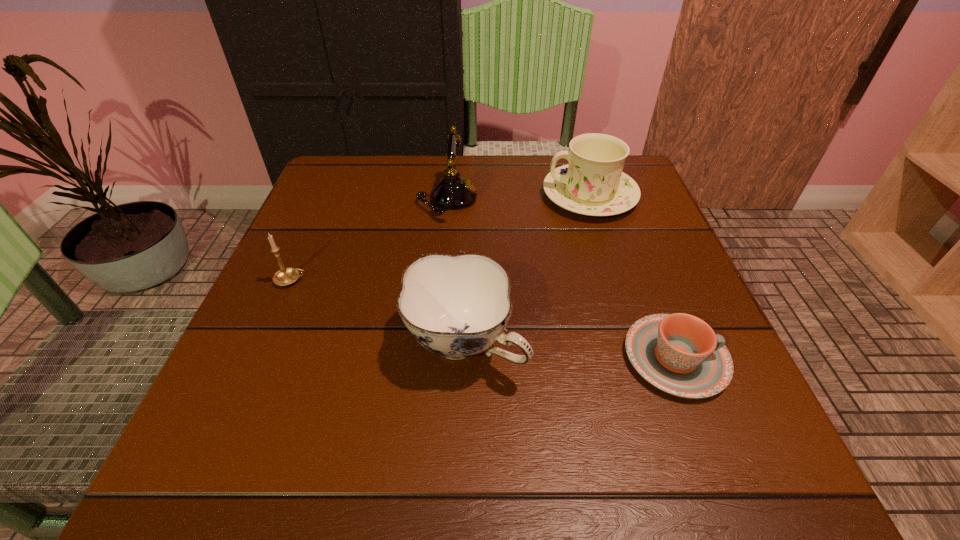
This screenshot has height=540, width=960. Find the location of `vacant space at the near left corner of the desktop`. vacant space at the near left corner of the desktop is located at coordinates (208, 471).

You are a GUI agent. You are given a task and a screenshot of the screen. Output one action in this format:
    pyautogui.click(x=<x>, y=<y>)
    Task: Click on the blank area at the far right corner
    
    Given the screenshot: What is the action you would take?
    pyautogui.click(x=625, y=163)

Find the location of a particular element. This screenshot has height=540, width=960. unoccupied area between the telephone and the shortest chinaware is located at coordinates tap(562, 278).

You are a GUI agent. You are given a task and a screenshot of the screen. Output one action in this format:
    pyautogui.click(x=<x>, y=<y>)
    Task: Click on the vacant area between the farthest chinaware and the shortest object
    
    Given the screenshot: What is the action you would take?
    pyautogui.click(x=633, y=277)

I want to click on free space that is in between the leftmost object and the telephone, so click(x=370, y=239).

Locate an element on the screen. free space between the farthest chinaware and the candle holder is located at coordinates (441, 238).

Identify the location of empty space between the telephone and the shortest chinaware. (562, 278).

The width and height of the screenshot is (960, 540). What are the coordinates of `vacant space that is in between the telephone and the farthest chinaware` in the screenshot? It's located at (x=518, y=197).

In order to click on empty space between the leftmost chinaware and the farthest chinaware in this screenshot , I will do `click(528, 269)`.

Identify the location of vacant area that lies between the telephone and the shortest chinaware. This screenshot has width=960, height=540. click(562, 278).